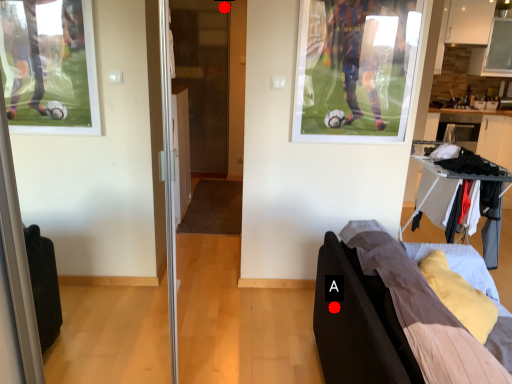
Question: Two points are circled on the image, labeled by A and B beside each circle. Which point is closer to the camera taking this photo?

Choices:
 (A) A is closer
 (B) B is closer

Answer: (A)